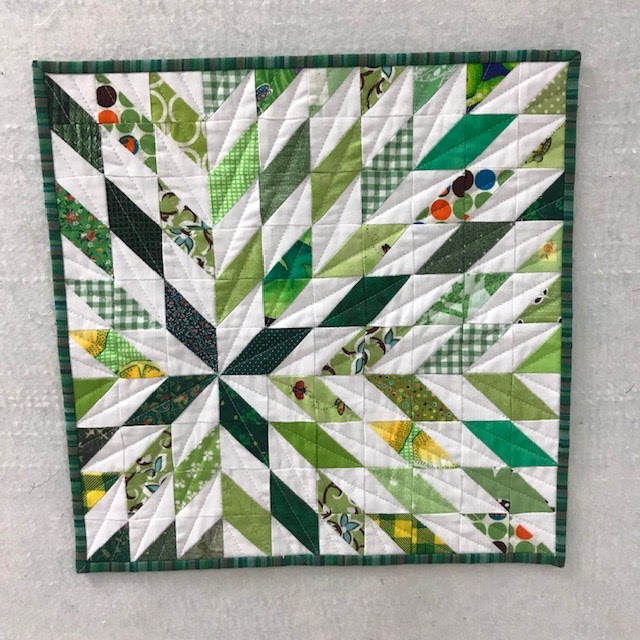
I want to click on lower right quilt corner, so click(559, 564).